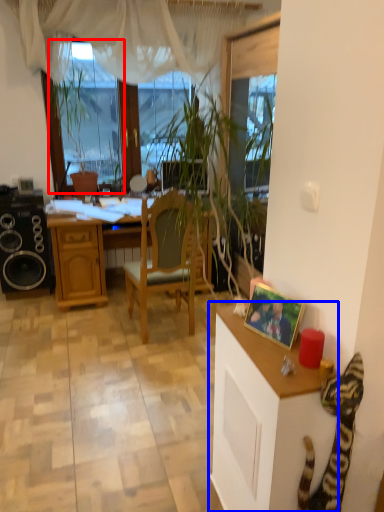
Question: Which point is further to the camera, window screen (highlighted by a red box) or cabinetry (highlighted by a blue box)?

Choices:
 (A) window screen
 (B) cabinetry

Answer: (A)